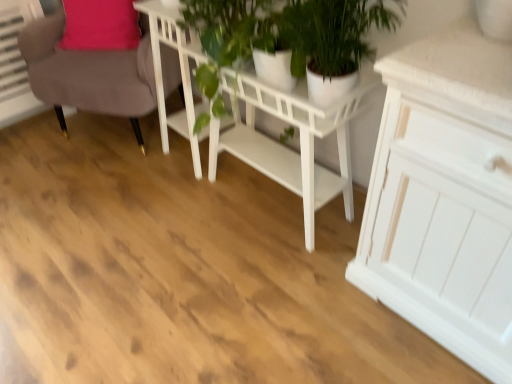
Find the location of a particular element. The image size is (512, 384). vacant region to the left of white wooden table at center, placed as the 1th table when sorted from left to right is located at coordinates (141, 162).